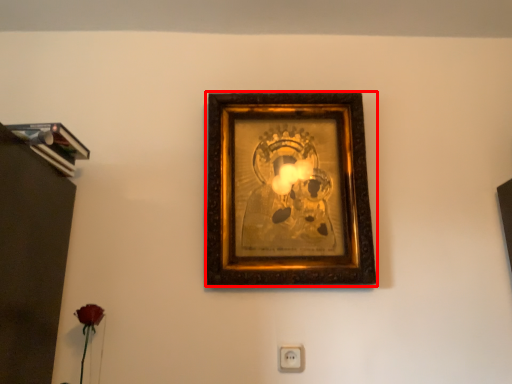
Question: From the image's perspective, where is picture frame (annotated by the red box) located relative to electric outlet?

Choices:
 (A) above
 (B) below

Answer: (A)